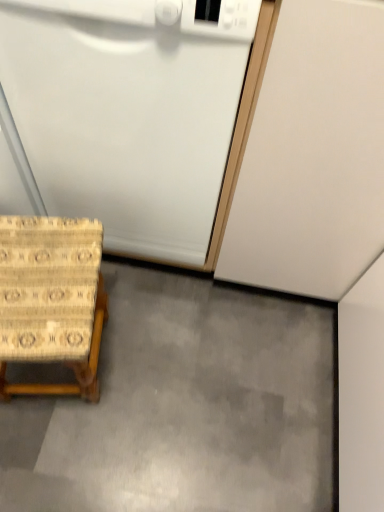
Question: Does gray smooth concrete at lower center have a lesser width compared to beige woven stool at lower left?

Choices:
 (A) yes
 (B) no

Answer: (B)

Question: Does gray smooth concrete at lower center have a lesser height compared to beige woven stool at lower left?

Choices:
 (A) no
 (B) yes

Answer: (B)

Question: Is gray smooth concrete at lower center in contact with beige woven stool at lower left?

Choices:
 (A) yes
 (B) no

Answer: (B)

Question: Does gray smooth concrete at lower center turn towards beige woven stool at lower left?

Choices:
 (A) yes
 (B) no

Answer: (B)

Question: Is gray smooth concrete at lower center at the left side of beige woven stool at lower left?

Choices:
 (A) yes
 (B) no

Answer: (B)

Question: Considering their positions, is gray smooth concrete at lower center located in front of or behind white matte dishwasher at lower left?

Choices:
 (A) front
 (B) behind

Answer: (B)

Question: From a real-world perspective, relative to white matte dishwasher at lower left, is gray smooth concrete at lower center vertically above or below?

Choices:
 (A) below
 (B) above

Answer: (A)

Question: From the image's perspective, is gray smooth concrete at lower center positioned above or below white matte dishwasher at lower left?

Choices:
 (A) below
 (B) above

Answer: (A)

Question: In the image, is gray smooth concrete at lower center on the left side or the right side of white matte dishwasher at lower left?

Choices:
 (A) right
 (B) left

Answer: (A)

Question: Considering the positions of point (48, 265) and point (11, 98), is point (48, 265) closer or farther from the camera than point (11, 98)?

Choices:
 (A) farther
 (B) closer

Answer: (A)

Question: Visually, is beige woven stool at lower left positioned to the left or to the right of white matte dishwasher at lower left?

Choices:
 (A) left
 (B) right

Answer: (A)

Question: Relative to white matte dishwasher at lower left, is beige woven stool at lower left in front or behind?

Choices:
 (A) behind
 (B) front

Answer: (A)

Question: From a real-world perspective, is beige woven stool at lower left positioned above or below white matte dishwasher at lower left?

Choices:
 (A) above
 (B) below

Answer: (B)

Question: Relative to gray smooth concrete at lower center, is white matte dishwasher at lower left in front or behind?

Choices:
 (A) front
 (B) behind

Answer: (A)

Question: Is white matte dishwasher at lower left situated inside gray smooth concrete at lower center or outside?

Choices:
 (A) inside
 (B) outside

Answer: (B)